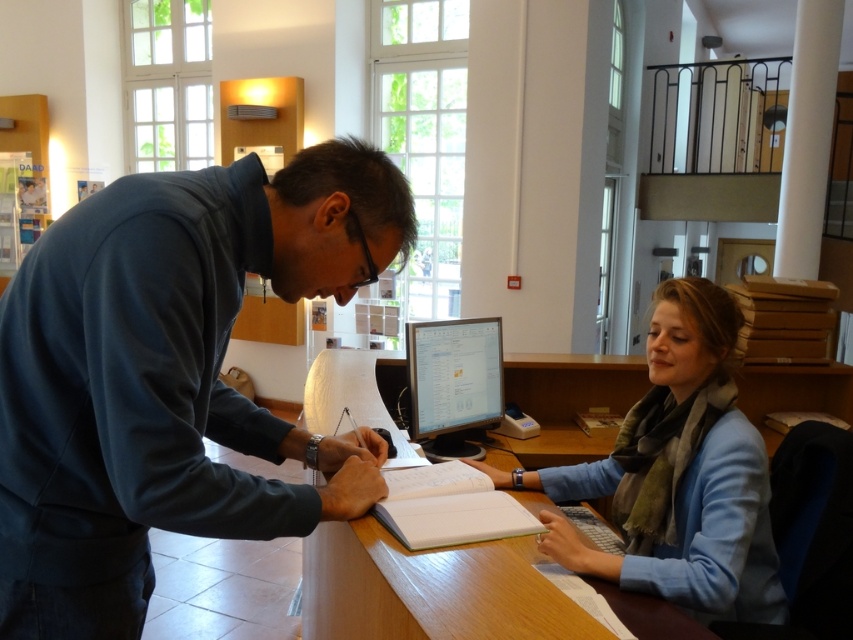
Question: Observing the image, what is the correct spatial positioning of dark blue fleece at left in reference to blue fabric scarf at center?

Choices:
 (A) left
 (B) right

Answer: (A)

Question: Among these objects, which one is farthest from the camera?

Choices:
 (A) wooden table at center
 (B) white paper notebook at center

Answer: (B)

Question: Does wooden table at center appear over white paper notebook at center?

Choices:
 (A) yes
 (B) no

Answer: (B)

Question: Based on their relative distances, which object is farther from the wooden table at center?

Choices:
 (A) white paper notebook at center
 (B) matte black monitor at center
 (C) blue fabric scarf at center

Answer: (B)

Question: Among these objects, which one is nearest to the camera?

Choices:
 (A) matte black monitor at center
 (B) white paper notebook at center
 (C) dark blue fleece at left

Answer: (C)

Question: From the image, what is the correct spatial relationship of dark blue fleece at left in relation to white paper notebook at center?

Choices:
 (A) left
 (B) right

Answer: (A)